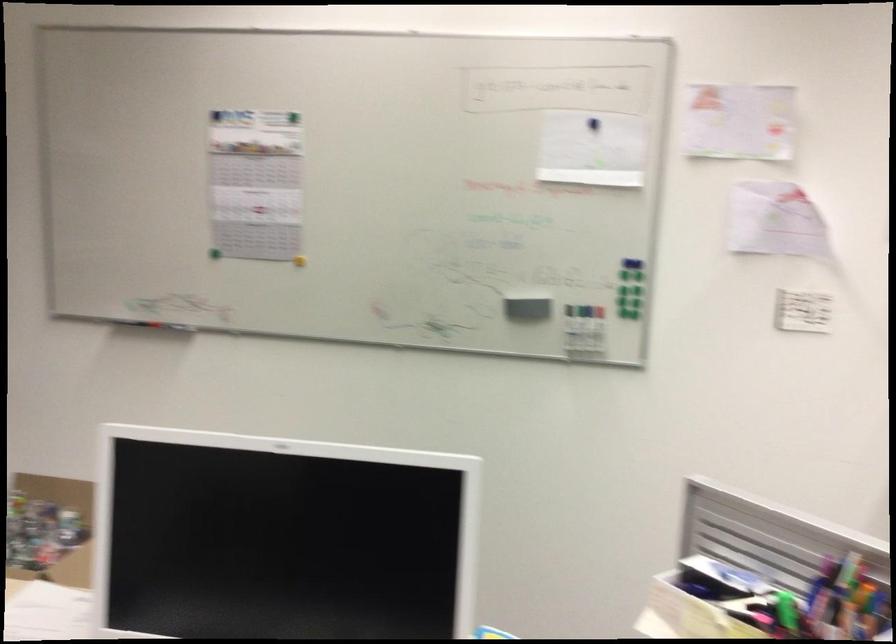
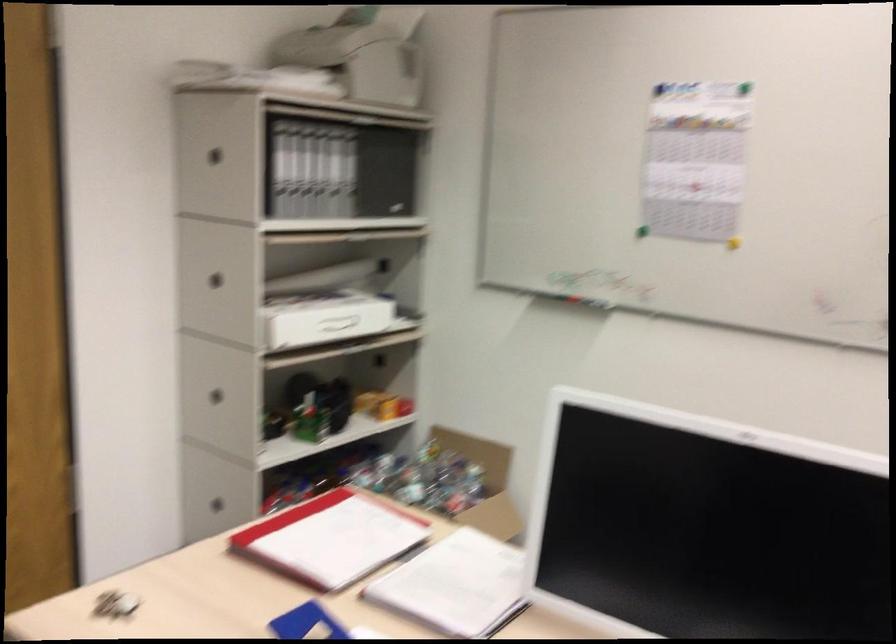
Question: The camera is either moving clockwise (left) or counter-clockwise (right) around the object. The first image is from the beginning of the video and the second image is from the end. Is the camera moving left or right when shooting the video?

Choices:
 (A) Left
 (B) Right

Answer: (B)